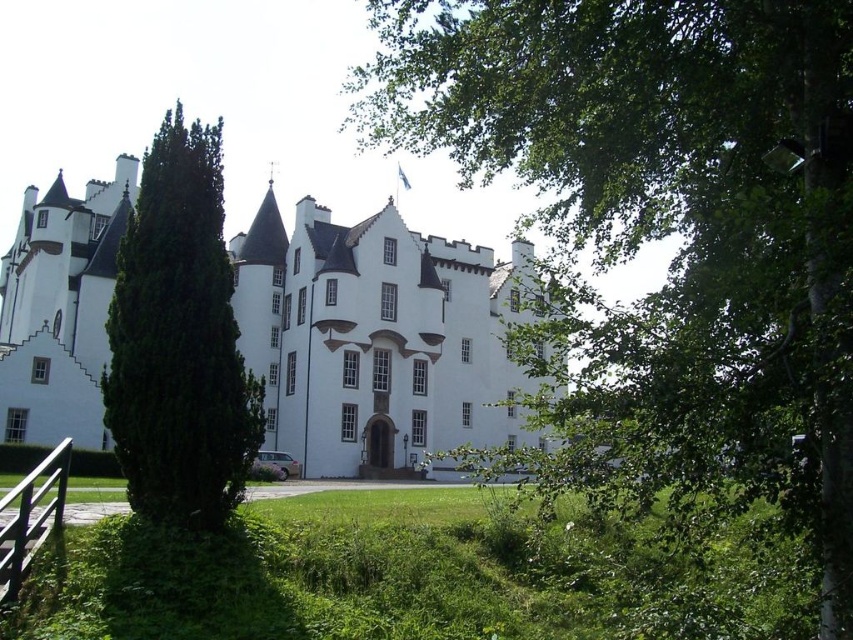
How far apart are white stone castle at center and green leafy tree at left?

white stone castle at center is 33.91 meters away from green leafy tree at left.

Who is more distant from viewer, [270,387] or [213,285]?

The point [270,387] is behind.

Locate an element on the screen. Image resolution: width=853 pixels, height=640 pixels. white stone castle at center is located at coordinates 375,339.

Who is taller, green leafy tree at center or green leafy tree at left?

Standing taller between the two is green leafy tree at center.

Who is lower down, green leafy tree at center or green leafy tree at left?

Positioned lower is green leafy tree at left.

The width and height of the screenshot is (853, 640). I want to click on green leafy tree at center, so click(x=668, y=225).

This screenshot has width=853, height=640. Find the location of `green leafy tree at center`. green leafy tree at center is located at coordinates (668, 225).

Can you confirm if green leafy tree at center is taller than white stone castle at center?

Correct, green leafy tree at center is much taller as white stone castle at center.

Can you confirm if green leafy tree at center is positioned to the right of white stone castle at center?

Yes, green leafy tree at center is to the right of white stone castle at center.

Is point (650, 45) positioned in front of point (260, 214)?

That is True.

Where is `green leafy tree at center`? This screenshot has width=853, height=640. green leafy tree at center is located at coordinates (x=668, y=225).